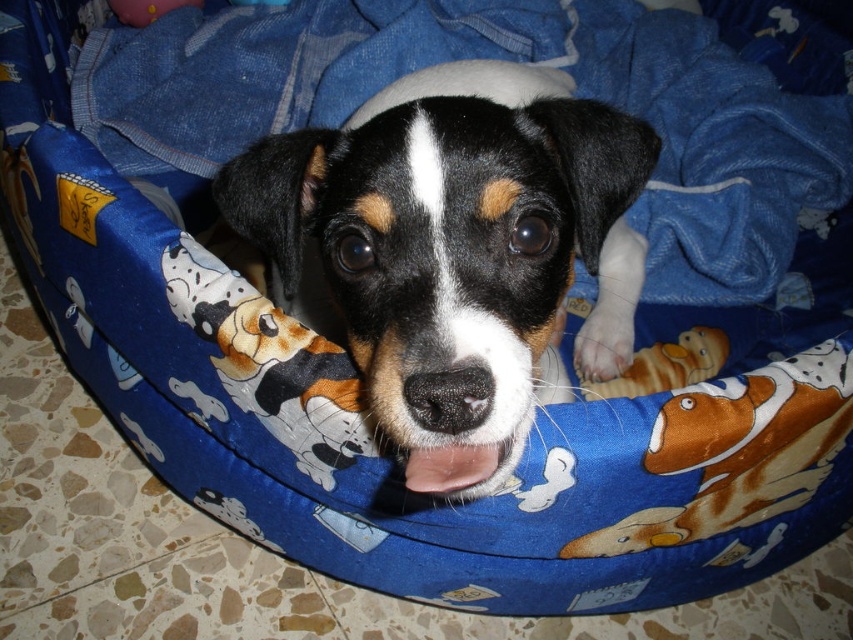
You are a photographer trying to capture the dog in the center of the image. The camera has a focus point at coordinate point (454, 252). Will this focus point align with the black fur dog at center?

Yes, the focus point at coordinate point (454, 252) corresponds to the black fur dog at center, so it will align perfectly.

You are a pet owner who wants to place a new toy on the bed where the dog is resting. The toy is 15 cm tall. Can the toy fit under the blue fabric blanket at center without overlapping the brown plush dog at center?

The blue fabric blanket at center is taller than the brown plush dog at center. Since the toy is 15 cm tall, it can fit under the blue fabric blanket at center without overlapping the brown plush dog at center as there is enough vertical space.

You need to place a new toy for the dog. The toy requires a space larger than the brown plush dog at center. Is there enough space on the blue fabric blanket at center?

The blue fabric blanket at center is larger in size than the brown plush dog at center. Therefore, there is enough space on the blue fabric blanket at center to place the new toy as it is bigger than the brown plush dog at center.